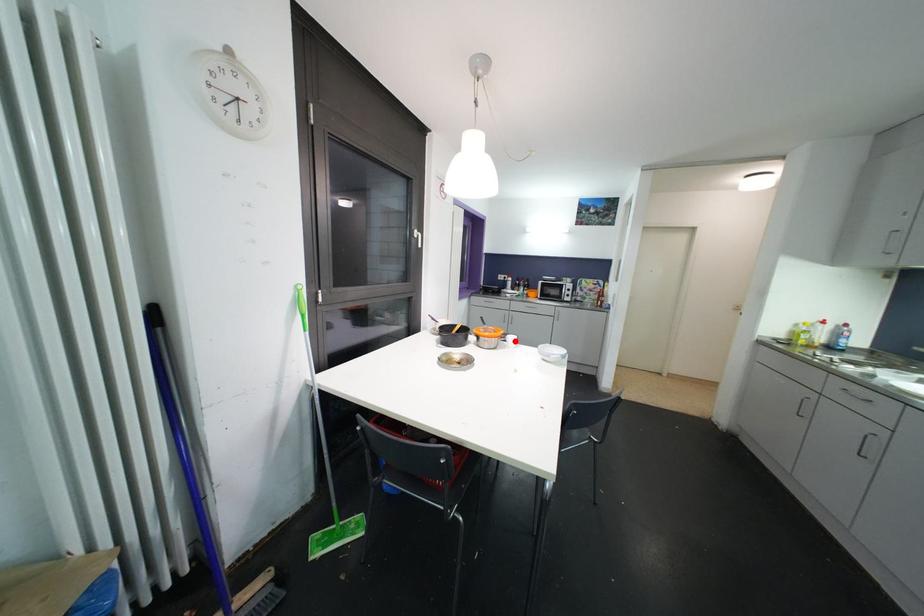
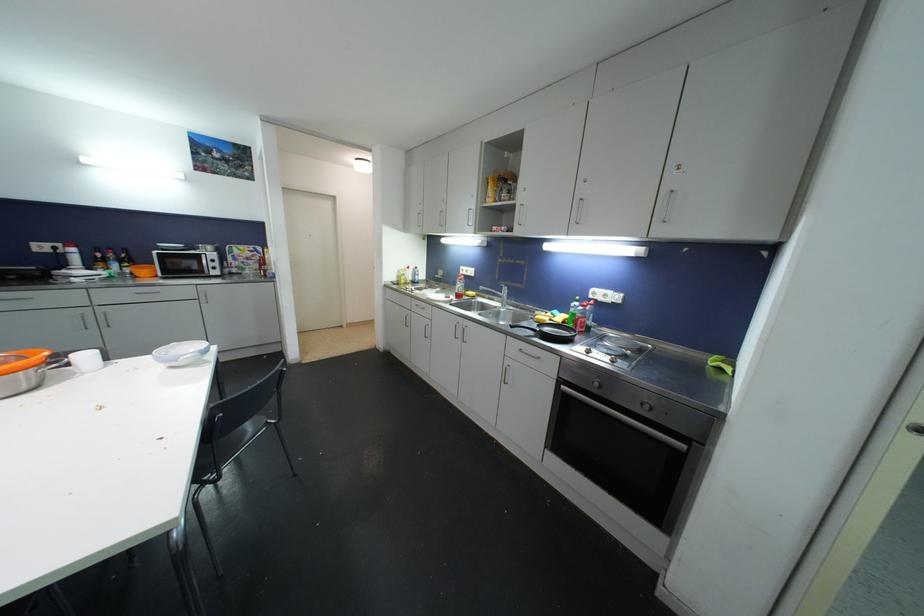
Find the pixel in the second image that matches the highlighted location in the first image.

(89, 360)